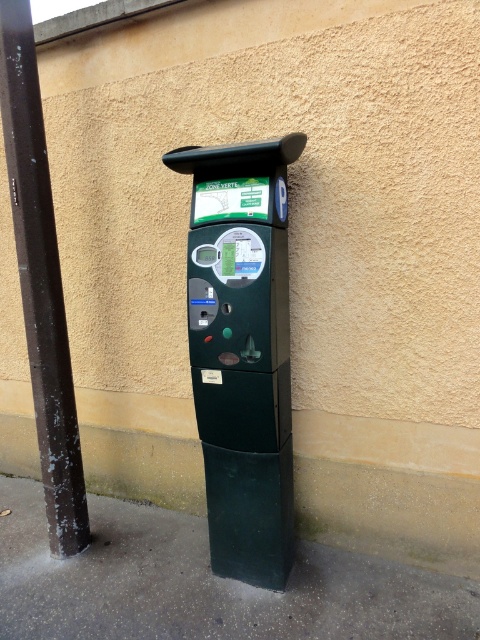
Question: Is matte black parking meter at center smaller than green matte trash can at lower center?

Choices:
 (A) no
 (B) yes

Answer: (A)

Question: Is matte black parking meter at center positioned before dark brown metal pole at left?

Choices:
 (A) no
 (B) yes

Answer: (B)

Question: Which point appears farthest from the camera in this image?

Choices:
 (A) click(x=49, y=282)
 (B) click(x=186, y=637)

Answer: (A)

Question: Considering the real-world distances, which object is closest to the matte black parking meter at center?

Choices:
 (A) dark brown metal pole at left
 (B) dark gray concrete pavement at lower center

Answer: (A)

Question: Can you confirm if dark gray concrete pavement at lower center is bigger than green matte trash can at lower center?

Choices:
 (A) yes
 (B) no

Answer: (A)

Question: Based on their relative distances, which object is nearer to the dark gray concrete pavement at lower center?

Choices:
 (A) matte black parking meter at center
 (B) dark brown metal pole at left

Answer: (A)